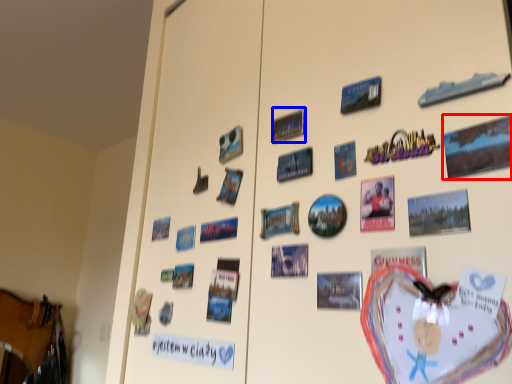
Question: Among these objects, which one is farthest to the camera, postcard (highlighted by a red box) or poster (highlighted by a blue box)?

Choices:
 (A) postcard
 (B) poster

Answer: (B)